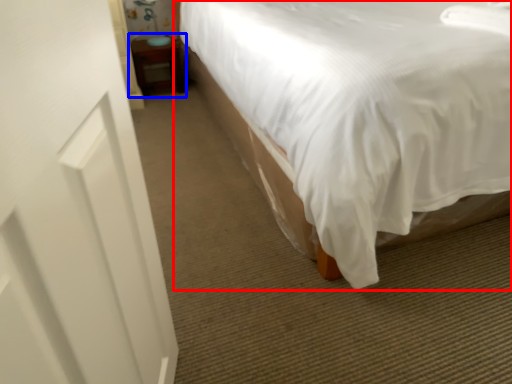
Question: Which of the following is the closest to the observer, bed (highlighted by a red box) or table (highlighted by a blue box)?

Choices:
 (A) bed
 (B) table

Answer: (A)